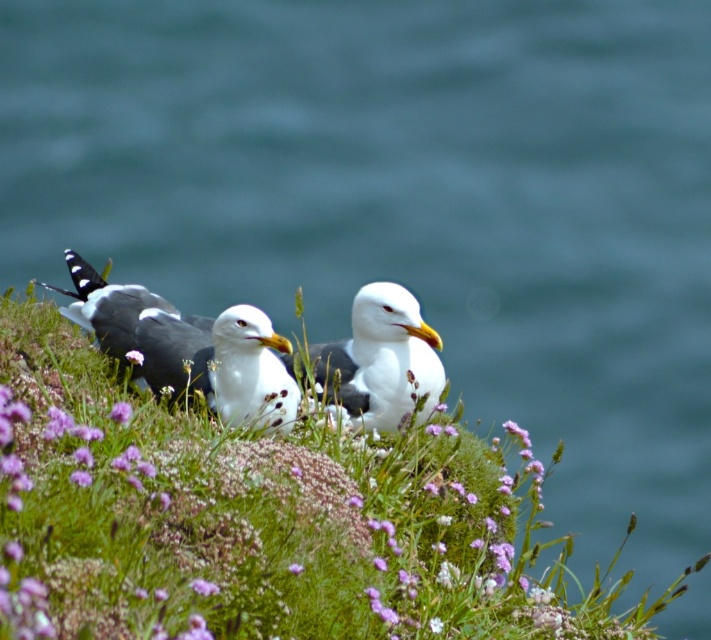
Can you confirm if white feathered seagull at center is taller than purple matte flower at center?

Yes.

The height and width of the screenshot is (640, 711). I want to click on white feathered seagull at center, so click(380, 360).

Identify the location of white feathered seagull at center. This screenshot has width=711, height=640. (380, 360).

Between white speckled feathers at center and white matte seagull at center, which one has less height?

With less height is white matte seagull at center.

Is white speckled feathers at center positioned in front of white matte seagull at center?

That is False.

Consider the image. Measure the distance between point [176,371] and camera.

Point [176,371] and camera are 6.40 meters apart.

Locate an element on the screen. white speckled feathers at center is located at coordinates (139, 328).

Is white speckled feathers at center thinner than purple fuzzy flower at center?

Incorrect, white speckled feathers at center's width is not less than purple fuzzy flower at center's.

Measure the distance between point [151,353] and camera.

Point [151,353] is 21.21 feet away from camera.

You are a GUI agent. You are given a task and a screenshot of the screen. Output one action in this format:
    pyautogui.click(x=<x>, y=<y>)
    Task: Click on the white speckled feathers at center
    
    Given the screenshot: What is the action you would take?
    pyautogui.click(x=139, y=328)